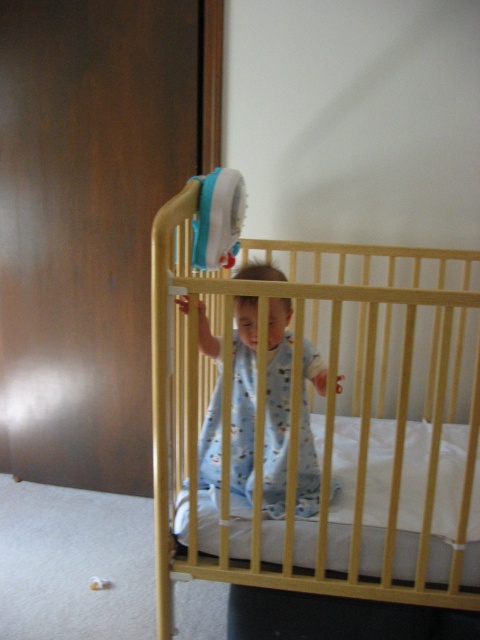
You are a parent checking on your child through the crib rail. You see the light blue cotton onesie at center and the blue fabric toy at upper center. Which item is closer to you?

The light blue cotton onesie at center is closer to the viewer than the blue fabric toy at upper center.